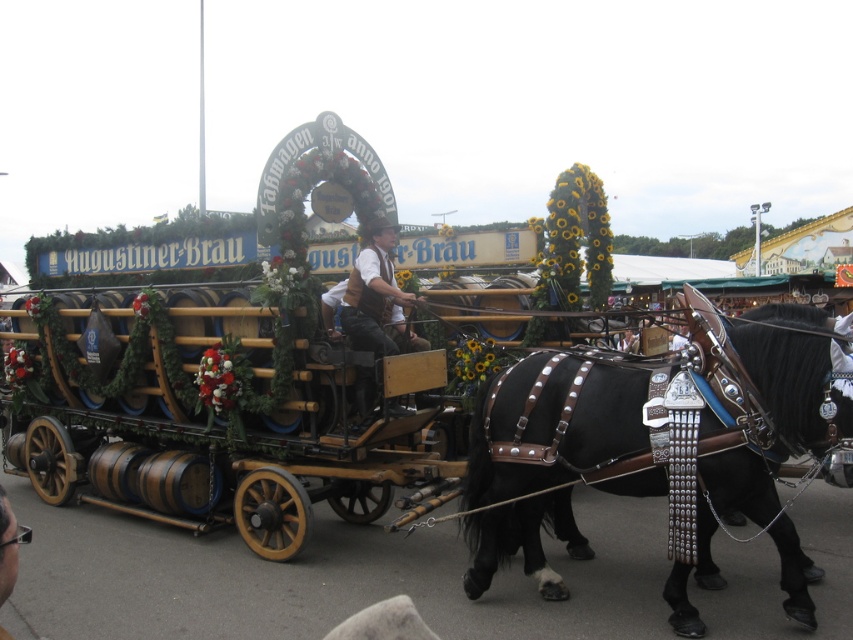
You are a photographer planning to take a portrait of the Augustiner Brau carriage. You want to ensure that both the black leather harness at center and the matte brown vest at center are clearly visible in the frame. Given their relative sizes, which object should you focus on first to ensure proper framing?

The black leather harness at center is taller than the matte brown vest at center. Therefore, you should focus on the black leather harness at center first to ensure it fits within the frame, as its greater height may require adjusting the camera angle or zoom to accommodate both objects properly.

You are standing in front of the Augustiner Brau carriage and want to place a decoration at point (691, 317) and another decoration at point (381, 237). Which decoration will be more visible to someone approaching the carriage from the front?

The decoration at point (691, 317) will be more visible because it is closer to the viewer than point (381, 237).

You are a photographer planning to take a closeup shot of the Augustiner Brau carriage. You want to ensure that both the black leather harness at center and the matte brown vest at center are clearly visible in the frame. Given their sizes, which object should you focus on first to ensure it is in focus?

The black leather harness at center is bigger than the matte brown vest at center, so you should focus on the black leather harness at center first to ensure it is in focus, as larger objects often require more precise focusing to capture all details clearly.